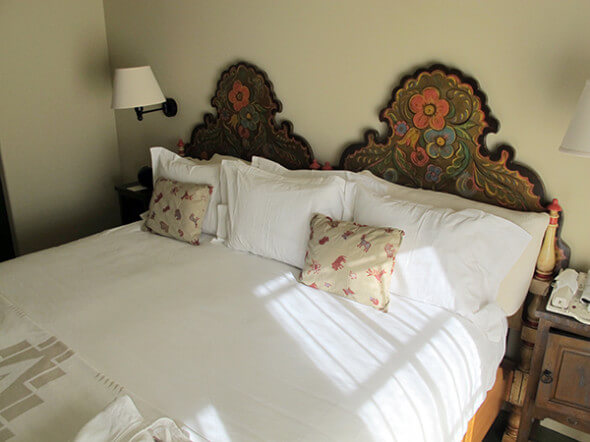
The image size is (590, 442). I want to click on door, so click(573, 371).